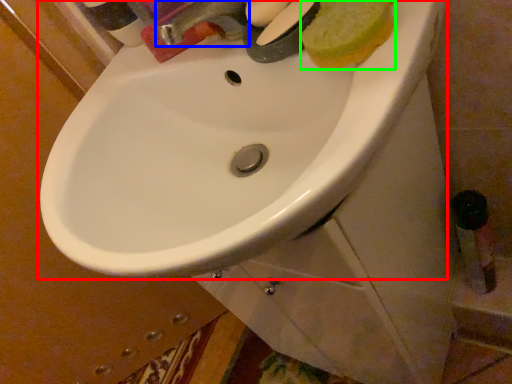
Question: Which object is positioned closest to sink (highlighted by a red box)? Select from tap (highlighted by a blue box) and food (highlighted by a green box).

Choices:
 (A) tap
 (B) food

Answer: (A)